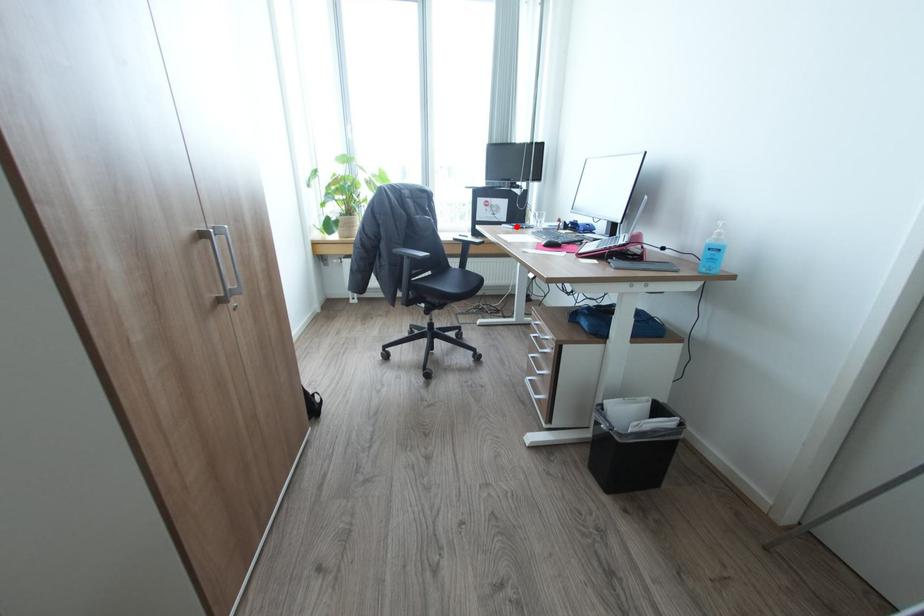
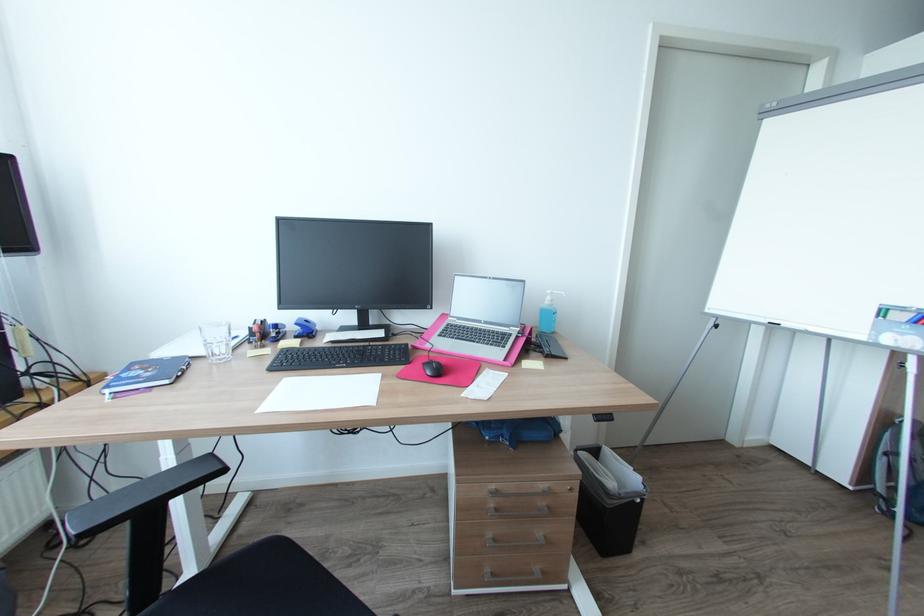
Find the pixel in the second image that matches the highlighted location in the first image.

(171, 381)